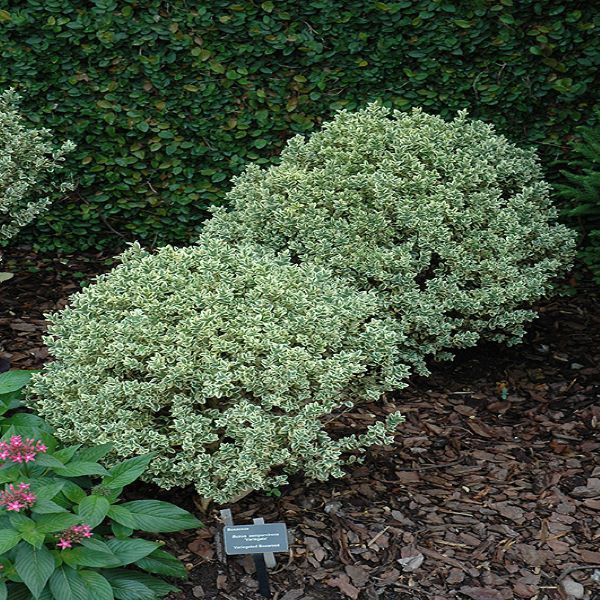
The height and width of the screenshot is (600, 600). What are the coordinates of `plant` in the screenshot? It's located at [x=234, y=458], [x=116, y=526].